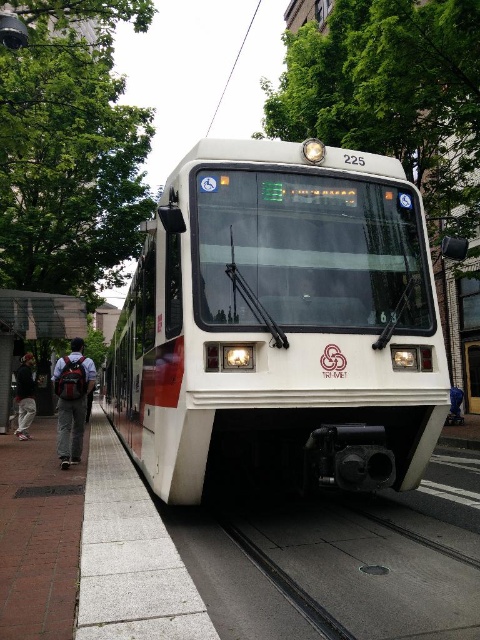
In the scene shown: Which is above, black rubber train track at center or matte red backpack at left?

Positioned higher is matte red backpack at left.

Is black rubber train track at center behind matte red backpack at left?

No, black rubber train track at center is closer to the viewer.

You are a GUI agent. You are given a task and a screenshot of the screen. Output one action in this format:
    pyautogui.click(x=<x>, y=<y>)
    Task: Click on the black rubber train track at center
    This screenshot has width=480, height=640.
    Given the screenshot: What is the action you would take?
    pyautogui.click(x=352, y=572)

Image resolution: width=480 pixels, height=640 pixels. What do you see at coordinates (280, 323) in the screenshot? I see `white glossy train at center` at bounding box center [280, 323].

Does white glossy train at center appear under dark gray backpack at left?

Yes.

Is point (355, 484) more distant than point (24, 400)?

No, it is not.

Find the location of a particular element. The width and height of the screenshot is (480, 640). white glossy train at center is located at coordinates (280, 323).

How far apart are matte red backpack at left and dark gray backpack at left?

matte red backpack at left and dark gray backpack at left are 5.13 meters apart.

Consider the image. How distant is matte red backpack at left from dark gray backpack at left?

The distance of matte red backpack at left from dark gray backpack at left is 5.13 meters.

Find the location of a particular element. The width and height of the screenshot is (480, 640). matte red backpack at left is located at coordinates (72, 401).

The width and height of the screenshot is (480, 640). In order to click on matte red backpack at left in this screenshot , I will do `click(72, 401)`.